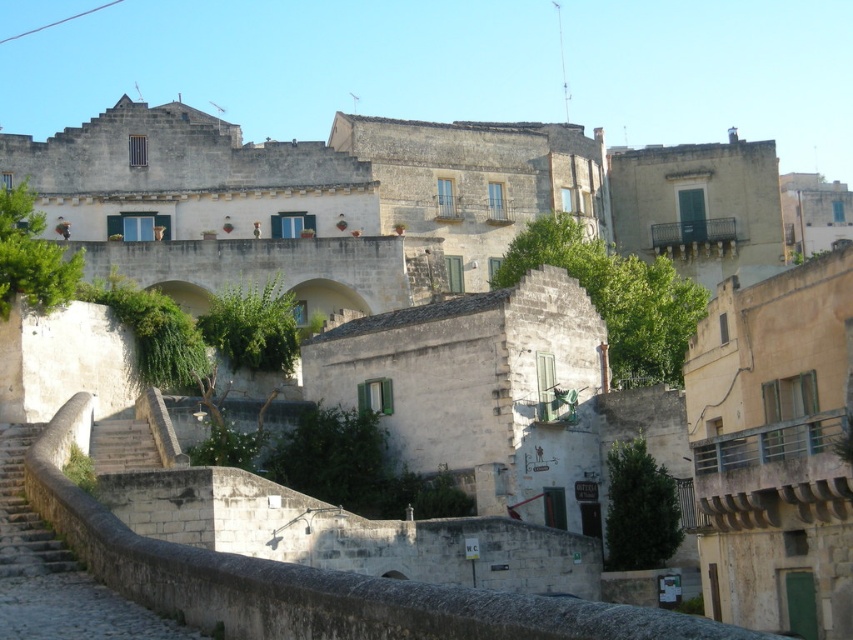
You are standing on the cobblestone street in the historic stone town and want to walk towards the stone bridge. Which point, point (x=4, y=436) or point (x=109, y=461), is closer to you?

Point (x=4, y=436) is in front of point (x=109, y=461), so it is closer to you.